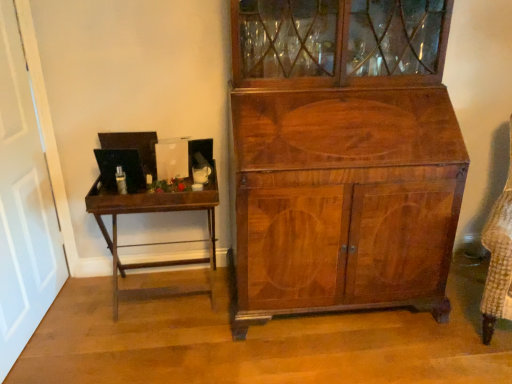
What do you see at coordinates (159, 242) in the screenshot? The width and height of the screenshot is (512, 384). I see `wooden table at left` at bounding box center [159, 242].

I want to click on wooden table at left, so click(159, 242).

At what (x,y) coordinates should I click in order to perform the action: click on wooden table at left. Please return your answer as a coordinate pair (x, y). This screenshot has height=384, width=512. Looking at the image, I should click on (159, 242).